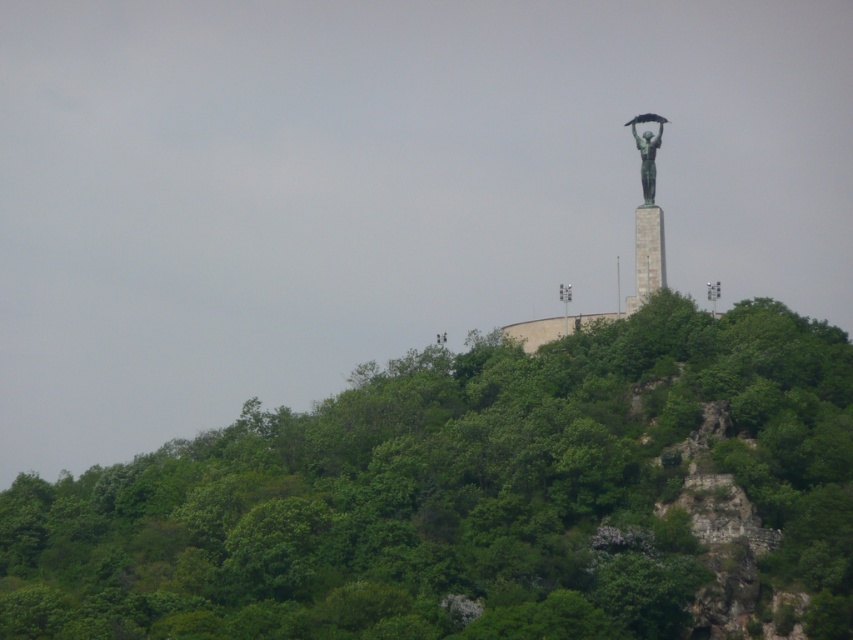
You are an artist planning to sketch the view of the statue from the base of the hill. You notice two objects at the upper center of your view. Which object will appear bigger in your sketch? The green leafy trees at upper center or the metallic gray lamp post at upper center?

The green leafy trees at upper center will appear bigger in your sketch because they are larger in size than the metallic gray lamp post at upper center.